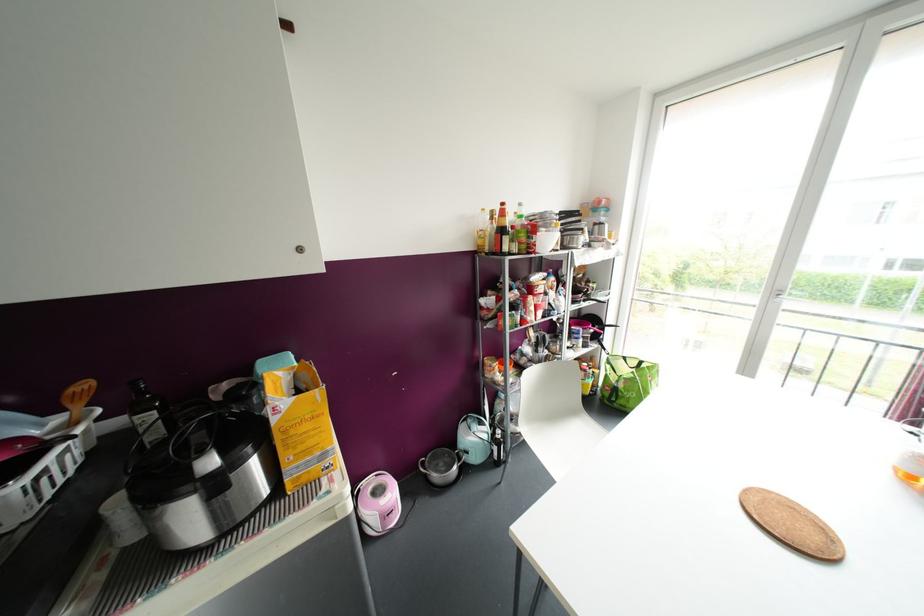
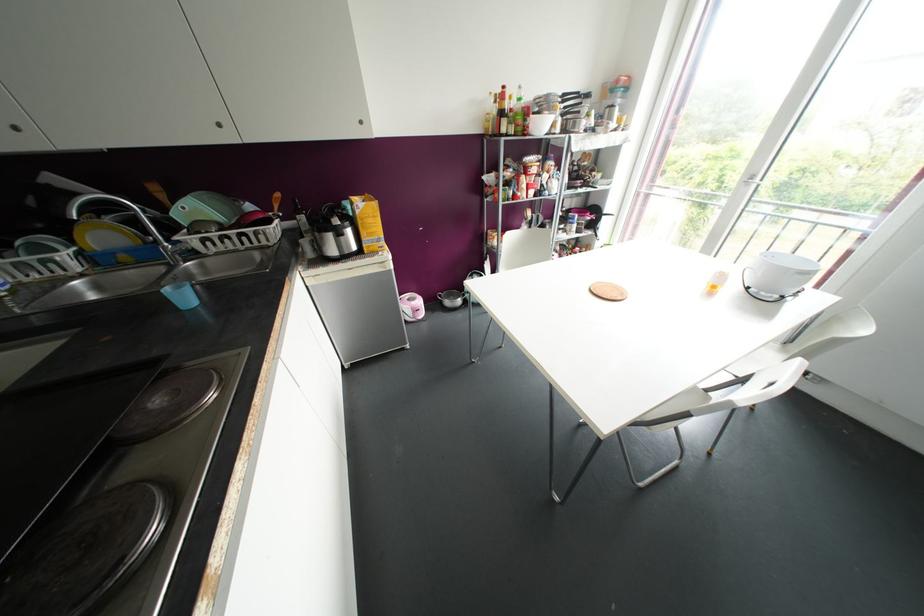
Question: I am providing you with two images of the same scene from different viewpoints. Please identify which objects are invisible in image2.

Choices:
 (A) circular wall handle
 (B) pink rice cooker
 (C) small yellow bottle
 (D) green shopping bag

Answer: (D)